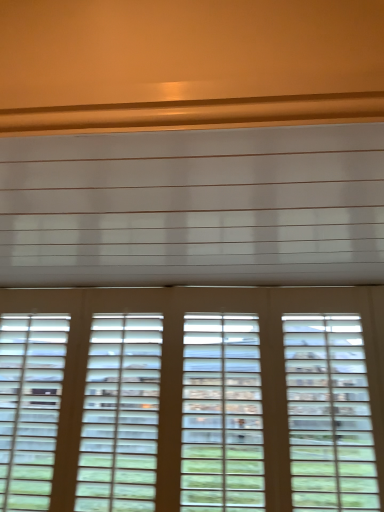
Question: From a real-world perspective, is white matte blind at upper center above or below wooden blinds at bottom?

Choices:
 (A) above
 (B) below

Answer: (A)

Question: From the image's perspective, is white matte blind at upper center positioned above or below wooden blinds at bottom?

Choices:
 (A) above
 (B) below

Answer: (A)

Question: Do you think white matte blind at upper center is within wooden blinds at bottom, or outside of it?

Choices:
 (A) outside
 (B) inside

Answer: (A)

Question: From the image's perspective, is wooden blinds at bottom positioned above or below white matte blind at upper center?

Choices:
 (A) below
 (B) above

Answer: (A)

Question: Is wooden blinds at bottom in front of or behind white matte blind at upper center in the image?

Choices:
 (A) behind
 (B) front

Answer: (A)

Question: Is wooden blinds at bottom inside the boundaries of white matte blind at upper center, or outside?

Choices:
 (A) outside
 (B) inside

Answer: (A)

Question: Looking at their shapes, would you say wooden blinds at bottom is wider or thinner than white matte blind at upper center?

Choices:
 (A) thin
 (B) wide

Answer: (A)